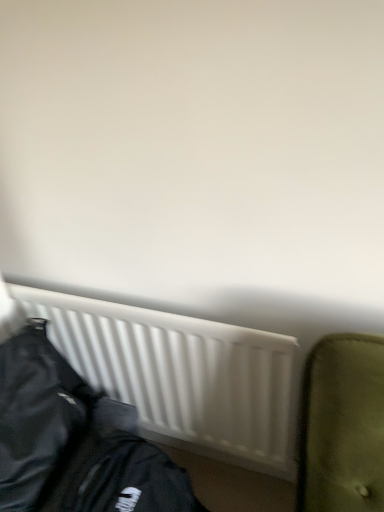
Identify the location of black leather jacket at lower left. (37, 417).

What do you see at coordinates (37, 417) in the screenshot?
I see `black leather jacket at lower left` at bounding box center [37, 417].

Locate an element on the screen. white matte radiator at lower center is located at coordinates (180, 374).

What do you see at coordinates (180, 374) in the screenshot? The image size is (384, 512). I see `white matte radiator at lower center` at bounding box center [180, 374].

Identify the location of black leather jacket at lower left. (37, 417).

In the scene shown: Which object is positioned more to the right, black leather jacket at lower left or white matte radiator at lower center?

white matte radiator at lower center is more to the right.

Is black leather jacket at lower left closer to camera compared to white matte radiator at lower center?

Yes, it is in front of white matte radiator at lower center.

Which is in front, point (81, 399) or point (223, 388)?

Point (223, 388)

From the picture: From the image's perspective, does black leather jacket at lower left appear higher than white matte radiator at lower center?

No, from the image's perspective, black leather jacket at lower left is not above white matte radiator at lower center.

From a real-world perspective, is black leather jacket at lower left located beneath white matte radiator at lower center?

No.

Which object is thinner, black leather jacket at lower left or white matte radiator at lower center?

Thinner between the two is white matte radiator at lower center.

Can you confirm if black leather jacket at lower left is shorter than white matte radiator at lower center?

Correct, black leather jacket at lower left is not as tall as white matte radiator at lower center.

Is black leather jacket at lower left smaller than white matte radiator at lower center?

Yes, black leather jacket at lower left is smaller than white matte radiator at lower center.

Is black leather jacket at lower left positioned beyond the bounds of white matte radiator at lower center?

black leather jacket at lower left is positioned outside white matte radiator at lower center.

Are black leather jacket at lower left and white matte radiator at lower center making contact?

No.

Is black leather jacket at lower left facing away from white matte radiator at lower center?

No.

Can you tell me how much black leather jacket at lower left and white matte radiator at lower center differ in facing direction?

There is a 88-degree angle between the facing directions of black leather jacket at lower left and white matte radiator at lower center.

The image size is (384, 512). What are the coordinates of `jacket below the white matte radiator at lower center (from the image's perspective)` in the screenshot? It's located at (37, 417).

Which is more to the right, white matte radiator at lower center or black leather jacket at lower left?

Positioned to the right is white matte radiator at lower center.

Considering the positions of objects white matte radiator at lower center and black leather jacket at lower left in the image provided, who is behind, white matte radiator at lower center or black leather jacket at lower left?

Positioned behind is white matte radiator at lower center.

Looking at this image, which is more distant, (x=202, y=361) or (x=61, y=387)?

Point (x=61, y=387)

From the image's perspective, does white matte radiator at lower center appear lower than black leather jacket at lower left?

No.

From a real-world perspective, is white matte radiator at lower center under black leather jacket at lower left?

Correct, in the physical world, white matte radiator at lower center is lower than black leather jacket at lower left.

In terms of width, does white matte radiator at lower center look wider or thinner when compared to black leather jacket at lower left?

white matte radiator at lower center is thinner than black leather jacket at lower left.

Is white matte radiator at lower center taller than black leather jacket at lower left?

Yes.

Looking at this image, based on their sizes in the image, would you say white matte radiator at lower center is bigger or smaller than black leather jacket at lower left?

white matte radiator at lower center is bigger than black leather jacket at lower left.

Is black leather jacket at lower left surrounded by white matte radiator at lower center?

No, black leather jacket at lower left is not surrounded by white matte radiator at lower center.

Is white matte radiator at lower center not near black leather jacket at lower left?

They are positioned close to each other.

From the picture: Is white matte radiator at lower center facing away from black leather jacket at lower left?

Yes, white matte radiator at lower center's orientation is away from black leather jacket at lower left.

You are a GUI agent. You are given a task and a screenshot of the screen. Output one action in this format:
    pyautogui.click(x=<x>, y=<y>)
    Task: Click on the jacket in front of the white matte radiator at lower center
    
    Given the screenshot: What is the action you would take?
    pyautogui.click(x=37, y=417)

What are the coordinates of `jacket above the white matte radiator at lower center (from a real-world perspective)` in the screenshot? It's located at (37, 417).

In the image, there is a black leather jacket at lower left. Identify the location of radiator below it (from a real-world perspective). (180, 374).